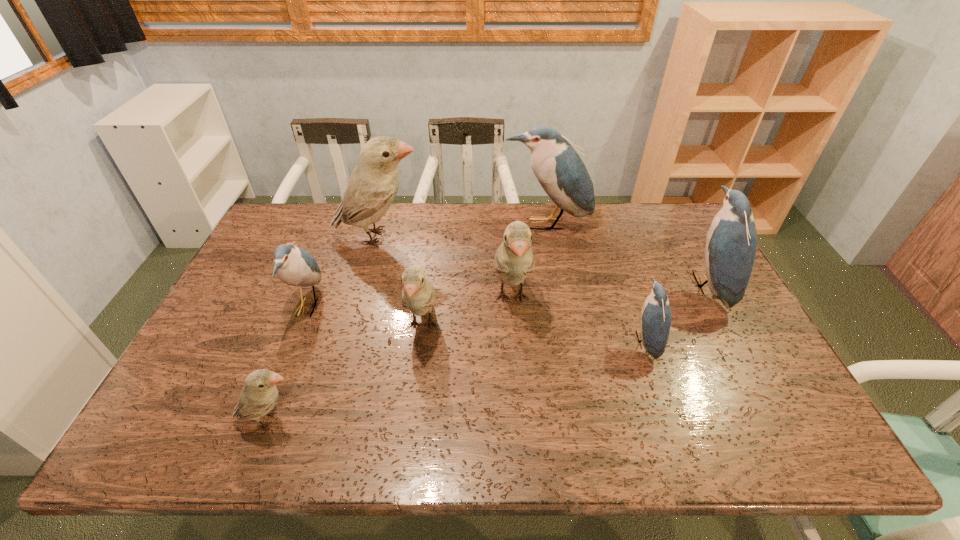
Where is `vacant space that satisfies the following two spatial constraints: 1. at the face of the second smallest white bird; 2. at the face of the smallest white bird`? The width and height of the screenshot is (960, 540). vacant space that satisfies the following two spatial constraints: 1. at the face of the second smallest white bird; 2. at the face of the smallest white bird is located at coordinates (410, 420).